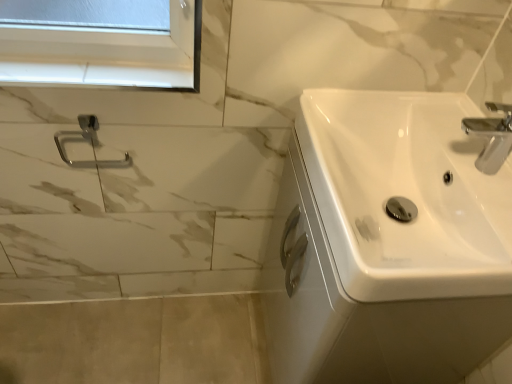
Where is `satin nickel towel ring at upper left`? satin nickel towel ring at upper left is located at coordinates (90, 143).

From the image's perspective, between satin nickel towel ring at upper left and white glossy window sill at upper left, who is located below?

satin nickel towel ring at upper left.

Is point (69, 137) farther from camera compared to point (126, 80)?

Yes.

Is satin nickel towel ring at upper left further to camera compared to white glossy window sill at upper left?

Yes, the depth of satin nickel towel ring at upper left is greater than that of white glossy window sill at upper left.

Can you confirm if satin nickel towel ring at upper left is bigger than white glossy window sill at upper left?

Yes, satin nickel towel ring at upper left is bigger than white glossy window sill at upper left.

Does white glossy window sill at upper left appear on the right side of satin nickel towel ring at upper left?

Correct, you'll find white glossy window sill at upper left to the right of satin nickel towel ring at upper left.

Is white glossy window sill at upper left positioned with its back to satin nickel towel ring at upper left?

white glossy window sill at upper left does not have its back to satin nickel towel ring at upper left.

This screenshot has width=512, height=384. I want to click on window sill above the satin nickel towel ring at upper left (from a real-world perspective), so click(x=93, y=75).

Find the location of a particular element. sink below the white glossy window sill at upper left (from the image's perspective) is located at coordinates (406, 194).

In the scene shown: Which of these two, white glossy window sill at upper left or white glossy sink at right, is wider?

white glossy sink at right is wider.

Is white glossy sink at right at the back of white glossy window sill at upper left?

No.

From a real-world perspective, is white glossy window sill at upper left on top of white glossy sink at right?

Yes, from a real-world perspective, white glossy window sill at upper left is over white glossy sink at right

Looking at this image, from the image's perspective, between white glossy sink at right and white glossy window sill at upper left, which one is located above?

white glossy window sill at upper left appears higher in the image.

From a real-world perspective, which is physically above, white glossy sink at right or white glossy window sill at upper left?

white glossy window sill at upper left, from a real-world perspective.

Can you confirm if white glossy sink at right is bigger than white glossy window sill at upper left?

Yes.

Is white glossy window sill at upper left completely or partially inside white glossy sink at right?

No, white glossy window sill at upper left is not inside white glossy sink at right.

Does point (109, 163) lie behind point (417, 150)?

Yes, point (109, 163) is farther from viewer.

Is satin nickel towel ring at upper left surrounding white glossy sink at right?

No.

Considering the sizes of objects satin nickel towel ring at upper left and white glossy sink at right in the image provided, who is thinner, satin nickel towel ring at upper left or white glossy sink at right?

Thinner between the two is satin nickel towel ring at upper left.

In the scene shown: Considering the relative sizes of white glossy sink at right and satin nickel towel ring at upper left in the image provided, is white glossy sink at right wider than satin nickel towel ring at upper left?

Correct, the width of white glossy sink at right exceeds that of satin nickel towel ring at upper left.

From the image's perspective, which one is positioned lower, white glossy sink at right or satin nickel towel ring at upper left?

white glossy sink at right, from the image's perspective.

Does white glossy sink at right have a larger size compared to satin nickel towel ring at upper left?

Correct, white glossy sink at right is larger in size than satin nickel towel ring at upper left.

In the scene shown: Is white glossy sink at right behind satin nickel towel ring at upper left?

No, it is not.

The height and width of the screenshot is (384, 512). Find the location of `shower that appears below the white glossy window sill at upper left (from a real-world perspective)`. shower that appears below the white glossy window sill at upper left (from a real-world perspective) is located at coordinates (90, 143).

Locate an element on the screen. window sill to the right of satin nickel towel ring at upper left is located at coordinates (93, 75).

Which object lies nearer to the anchor point satin nickel towel ring at upper left, white glossy sink at right or white glossy window sill at upper left?

white glossy window sill at upper left is positioned closer to the anchor satin nickel towel ring at upper left.

From the image, which object appears to be farther from white glossy window sill at upper left, white glossy sink at right or satin nickel towel ring at upper left?

white glossy sink at right lies further to white glossy window sill at upper left than the other object.

Considering their positions, is satin nickel towel ring at upper left positioned closer to white glossy window sill at upper left than white glossy sink at right?

satin nickel towel ring at upper left.

When comparing their distances from white glossy sink at right, does white glossy window sill at upper left or satin nickel towel ring at upper left seem further?

Based on the image, satin nickel towel ring at upper left appears to be further to white glossy sink at right.

Estimate the real-world distances between objects in this image. Which object is further from satin nickel towel ring at upper left, white glossy window sill at upper left or white glossy sink at right?

white glossy sink at right is further to satin nickel towel ring at upper left.

When comparing their distances from white glossy sink at right, does satin nickel towel ring at upper left or white glossy window sill at upper left seem closer?

white glossy window sill at upper left is closer to white glossy sink at right.

Identify the location of window sill between satin nickel towel ring at upper left and white glossy sink at right from left to right. (93, 75).